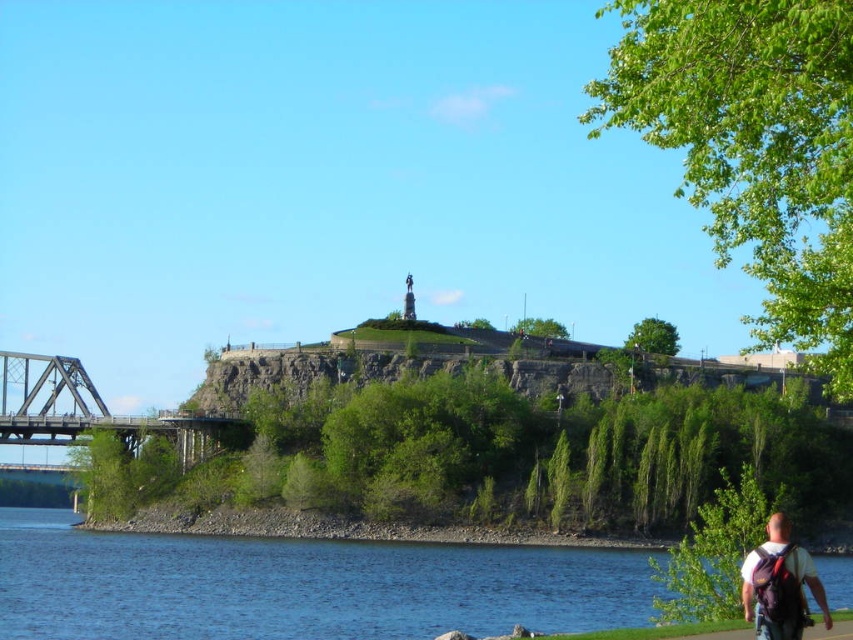
Question: Which point appears closest to the camera in this image?

Choices:
 (A) (453, 560)
 (B) (749, 582)

Answer: (B)

Question: Is blue water at lower left above white matte shirt at lower right?

Choices:
 (A) yes
 (B) no

Answer: (B)

Question: Which object is positioned farthest from the white matte shirt at lower right?

Choices:
 (A) blue water at lower left
 (B) metallic gray bridge at left

Answer: (B)

Question: Is blue water at lower left below metallic gray bridge at left?

Choices:
 (A) yes
 (B) no

Answer: (A)

Question: Is blue water at lower left thinner than metallic gray bridge at left?

Choices:
 (A) yes
 (B) no

Answer: (B)

Question: Which object is closer to the camera taking this photo?

Choices:
 (A) blue water at lower left
 (B) white matte shirt at lower right

Answer: (B)